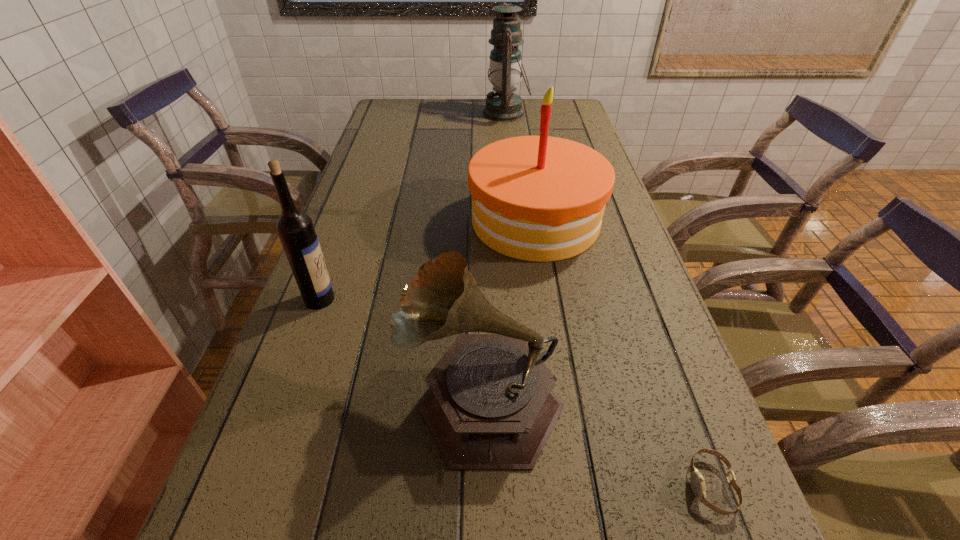
The height and width of the screenshot is (540, 960). What are the coordinates of `free spot located on the horn direction of the fourth tallest object` in the screenshot? It's located at (292, 397).

You are a GUI agent. You are given a task and a screenshot of the screen. Output one action in this format:
    pyautogui.click(x=<x>, y=<y>)
    Task: Click on the vacant space located 0.090m on the horn direction of the fourth tallest object
    This screenshot has width=960, height=540.
    Given the screenshot: What is the action you would take?
    pyautogui.click(x=348, y=397)

Where is `blank space located 0.120m on the face of the shortest object`? blank space located 0.120m on the face of the shortest object is located at coordinates (611, 485).

You are a GUI agent. You are given a task and a screenshot of the screen. Output one action in this format:
    pyautogui.click(x=<x>, y=<y>)
    Task: Click on the free location located 0.100m on the face of the shortest object
    This screenshot has width=960, height=540.
    Given the screenshot: What is the action you would take?
    pyautogui.click(x=624, y=485)

Locate an element on the screen. vacant position located on the face of the shortest object is located at coordinates (657, 485).

Identify the location of object positioned at the far edge. (505, 69).

The width and height of the screenshot is (960, 540). In order to click on object located at the left edge in this screenshot , I will do `click(295, 228)`.

The width and height of the screenshot is (960, 540). I want to click on birthday cake that is positioned at the right edge, so click(536, 198).

Locate an element on the screen. This screenshot has height=540, width=960. watch that is positioned at the right edge is located at coordinates 697,482.

Locate an element on the screen. Image resolution: width=960 pixels, height=540 pixels. vacant space at the far edge of the desktop is located at coordinates coord(522,121).